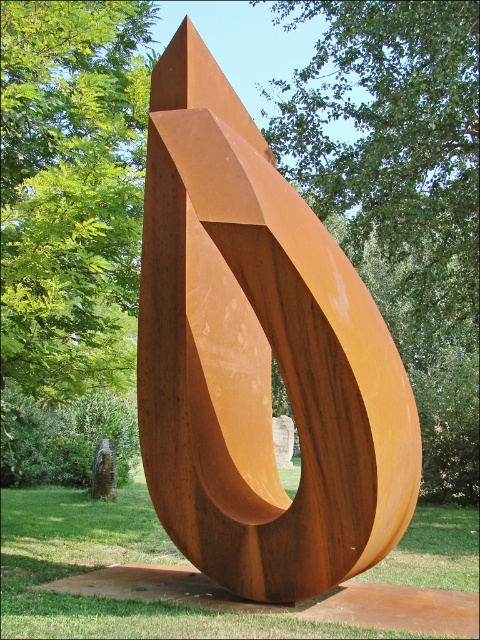
You are an artist planning to photograph the rusty metal abstract at center and the green leafy tree at upper left. Which object appears wider in the image?

The rusty metal abstract at center appears wider than the green leafy tree at upper left according to the description.

You are an artist planning to photograph the rusty metal abstract at center and the green leafy tree at upper left. Which object will appear closer to the camera in your photo?

The rusty metal abstract at center will appear closer to the camera because it is positioned in front of the green leafy tree at upper left.